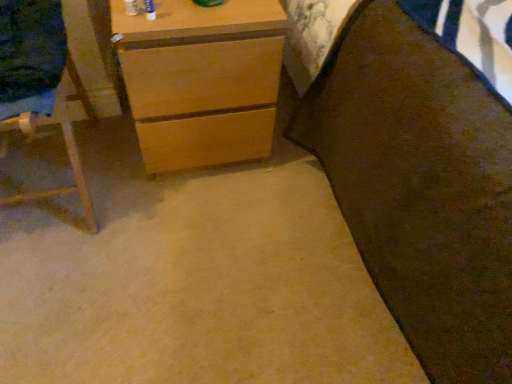
Where is `free space in front of wooden easel at left`? This screenshot has width=512, height=384. free space in front of wooden easel at left is located at coordinates (58, 287).